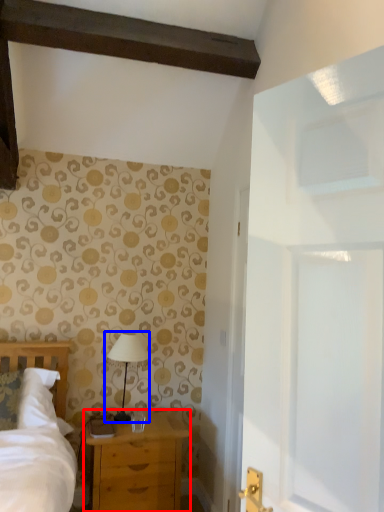
Question: Which of the following is the closest to the observer, chest of drawers (highlighted by a red box) or table lamp (highlighted by a blue box)?

Choices:
 (A) chest of drawers
 (B) table lamp

Answer: (A)